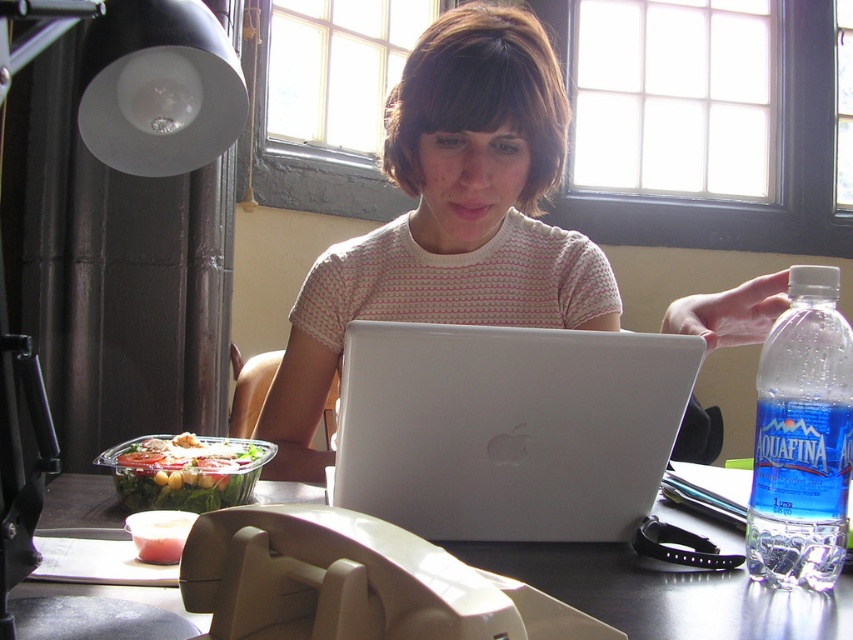
Does white matte laptop at center appear under fresh green salad at left?

No, white matte laptop at center is not below fresh green salad at left.

Can you confirm if white matte laptop at center is smaller than fresh green salad at left?

Incorrect, white matte laptop at center is not smaller in size than fresh green salad at left.

Which is behind, point (509, 506) or point (170, 474)?

Point (170, 474)

The height and width of the screenshot is (640, 853). What are the coordinates of `white matte laptop at center` in the screenshot? It's located at (508, 428).

Consider the image. Who is more forward, (x=289, y=422) or (x=457, y=385)?

Point (x=457, y=385)

Is point (280, 404) farther from camera compared to point (397, 388)?

That is True.

Where is `matte white laptop at center`? matte white laptop at center is located at coordinates (450, 220).

Does black plastic table at center have a lesser height compared to fresh green salad at left?

Yes.

Does point (660, 602) come closer to viewer compared to point (204, 444)?

That is True.

Is point (805, 612) less distant than point (216, 474)?

Yes, point (805, 612) is closer to viewer.

Locate an element on the screen. The image size is (853, 640). black plastic table at center is located at coordinates (665, 593).